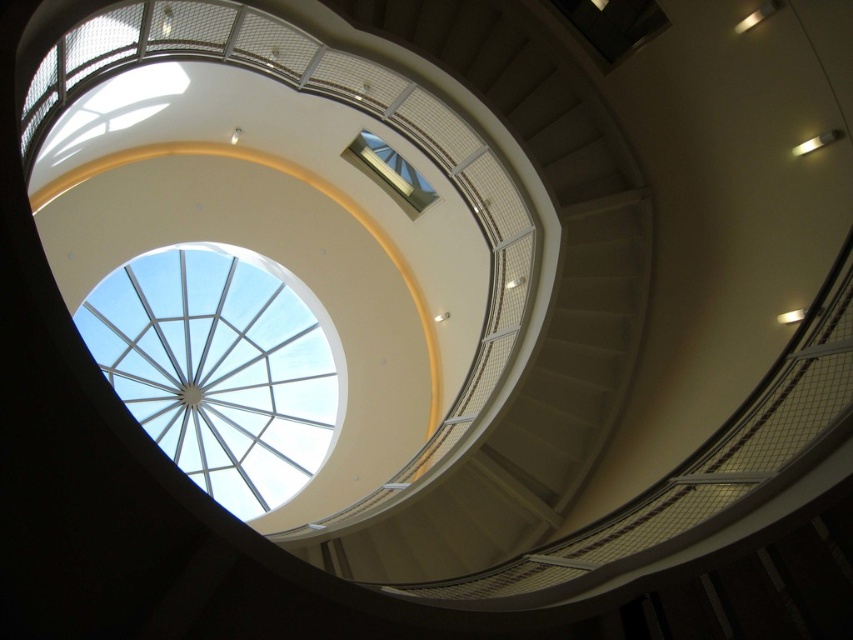
Which is more to the left, transparent glass dome at upper center or clear glass window at upper center?

transparent glass dome at upper center

Between transparent glass dome at upper center and clear glass window at upper center, which one is positioned lower?

transparent glass dome at upper center is below.

Where is `transparent glass dome at upper center`? transparent glass dome at upper center is located at coordinates (218, 371).

In order to click on transparent glass dome at upper center in this screenshot , I will do `click(218, 371)`.

The width and height of the screenshot is (853, 640). What do you see at coordinates (547, 307) in the screenshot? I see `white matte staircase at center` at bounding box center [547, 307].

Which is behind, point (318, 554) or point (154, 381)?

The point (154, 381) is more distant.

Identify the location of white matte staircase at center. (547, 307).

Which of these two, white matte staircase at center or clear glass window at upper center, stands taller?

With more height is white matte staircase at center.

Does point (438, 512) come farther from viewer compared to point (397, 177)?

No, it is not.

At what (x,y) coordinates should I click in order to perform the action: click on white matte staircase at center. Please return your answer as a coordinate pair (x, y). Looking at the image, I should click on (547, 307).